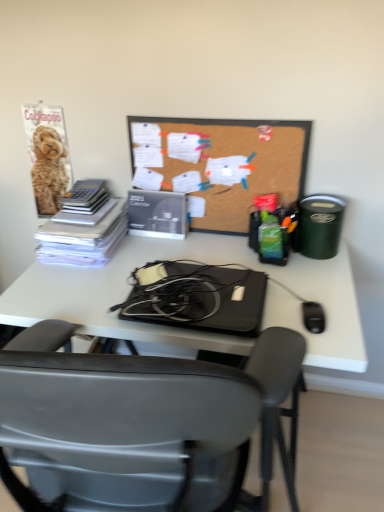
Question: Does corkboard at center have a lesser width compared to white paper stack at left?

Choices:
 (A) yes
 (B) no

Answer: (A)

Question: Considering the relative sizes of corkboard at center and white paper stack at left in the image provided, is corkboard at center bigger than white paper stack at left?

Choices:
 (A) yes
 (B) no

Answer: (A)

Question: From the image's perspective, does corkboard at center appear higher than white paper stack at left?

Choices:
 (A) no
 (B) yes

Answer: (B)

Question: Can you confirm if corkboard at center is taller than white paper stack at left?

Choices:
 (A) no
 (B) yes

Answer: (B)

Question: Is corkboard at center closer to the viewer compared to white paper stack at left?

Choices:
 (A) no
 (B) yes

Answer: (B)

Question: Which is correct: matte black calendar at center is inside corkboard at center, or outside of it?

Choices:
 (A) outside
 (B) inside

Answer: (A)

Question: Relative to corkboard at center, is matte black calendar at center in front or behind?

Choices:
 (A) front
 (B) behind

Answer: (B)

Question: Looking at their shapes, would you say matte black calendar at center is wider or thinner than corkboard at center?

Choices:
 (A) wide
 (B) thin

Answer: (A)

Question: From a real-world perspective, is matte black calendar at center physically located above or below corkboard at center?

Choices:
 (A) below
 (B) above

Answer: (A)

Question: In terms of size, does white paper stack at left appear bigger or smaller than matte black calendar at center?

Choices:
 (A) small
 (B) big

Answer: (B)

Question: From the image's perspective, is white paper stack at left positioned above or below matte black calendar at center?

Choices:
 (A) below
 (B) above

Answer: (A)

Question: In terms of width, does white paper stack at left look wider or thinner when compared to matte black calendar at center?

Choices:
 (A) thin
 (B) wide

Answer: (B)

Question: Is white paper stack at left in front of or behind matte black calendar at center in the image?

Choices:
 (A) front
 (B) behind

Answer: (A)

Question: Is black matte laptop at center wider or thinner than white paper stack at left?

Choices:
 (A) wide
 (B) thin

Answer: (B)

Question: Considering their positions, is black matte laptop at center located in front of or behind white paper stack at left?

Choices:
 (A) front
 (B) behind

Answer: (A)